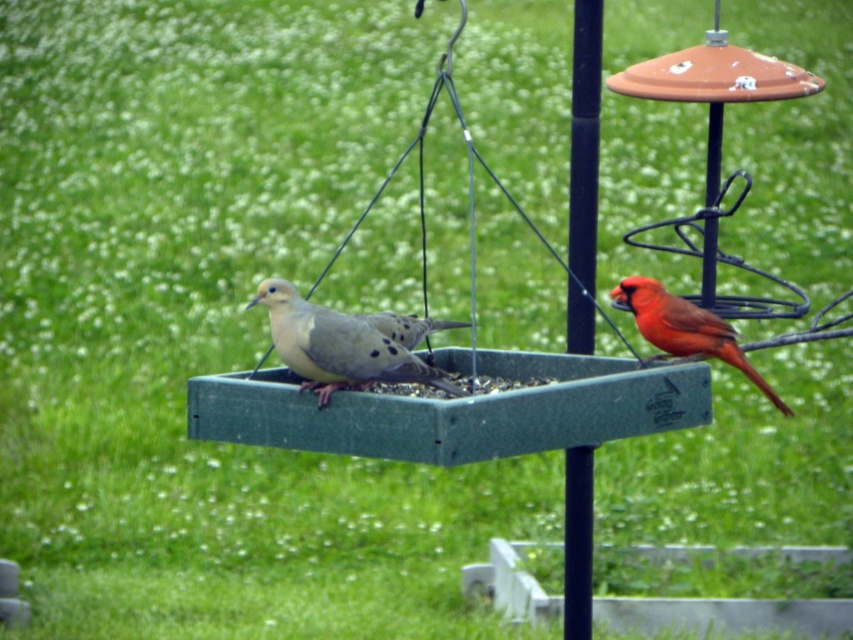
Question: Can you confirm if black metal pole at center is positioned above shiny red cardinal at right?

Choices:
 (A) yes
 (B) no

Answer: (A)

Question: Based on their relative distances, which object is farther from the black metal pole at center?

Choices:
 (A) speckled beige dove at center
 (B) shiny red cardinal at right

Answer: (A)

Question: Is speckled beige dove at center positioned in front of shiny red cardinal at right?

Choices:
 (A) no
 (B) yes

Answer: (B)

Question: Among these objects, which one is farthest from the camera?

Choices:
 (A) black metal pole at center
 (B) speckled beige dove at center

Answer: (A)

Question: Considering the relative positions of speckled beige dove at center and shiny red cardinal at right in the image provided, where is speckled beige dove at center located with respect to shiny red cardinal at right?

Choices:
 (A) left
 (B) right

Answer: (A)

Question: Which object appears closest to the camera in this image?

Choices:
 (A) shiny red cardinal at right
 (B) speckled beige dove at center
 (C) black metal pole at center

Answer: (B)